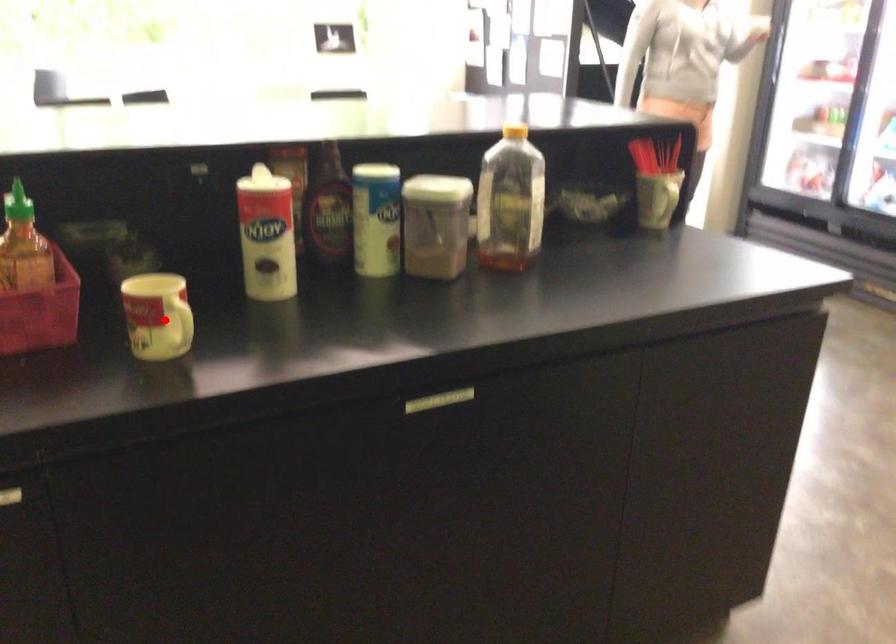
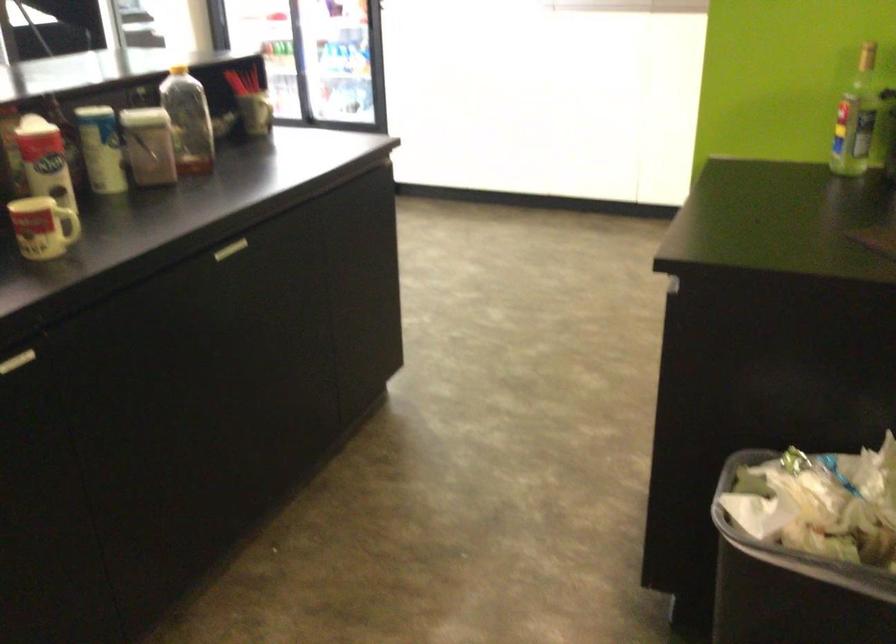
Question: I am providing you with two images of the same scene from different viewpoints. In image1, a red point is highlighted. Considering the same 3D point in image2, which of the following is correct?

Choices:
 (A) It is closer
 (B) It is farther

Answer: (B)